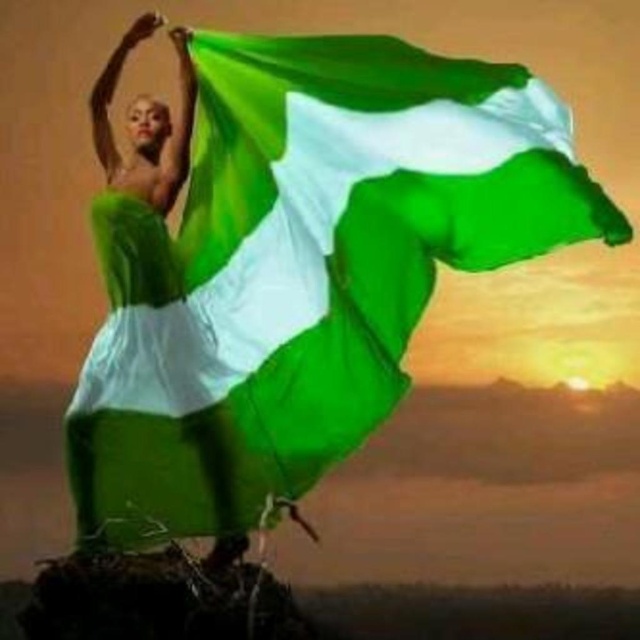
You are an observer watching the dancer in the scene. Which object is closer to you between the green fabric flag at center and the matte green fabric at center?

The green fabric flag at center is closer to you as it is positioned over the matte green fabric at center.

You are an event organizer planning a cultural festival and want to display both the green fabric flag at center and the matte green fabric at center on a single stand. The stand has a maximum width capacity of 2 meters. If the combined width of both fabrics exceeds the stand, they won the work. Based on the scene description, can both fabrics be displayed together on the stand without exceeding the width limit?

The green fabric flag at center has a larger width than the matte green fabric at center. However, without specific measurements, it is impossible to determine if their combined widths exceed the 2 meter limit. Additional information about each fabric width is needed to make a decision.